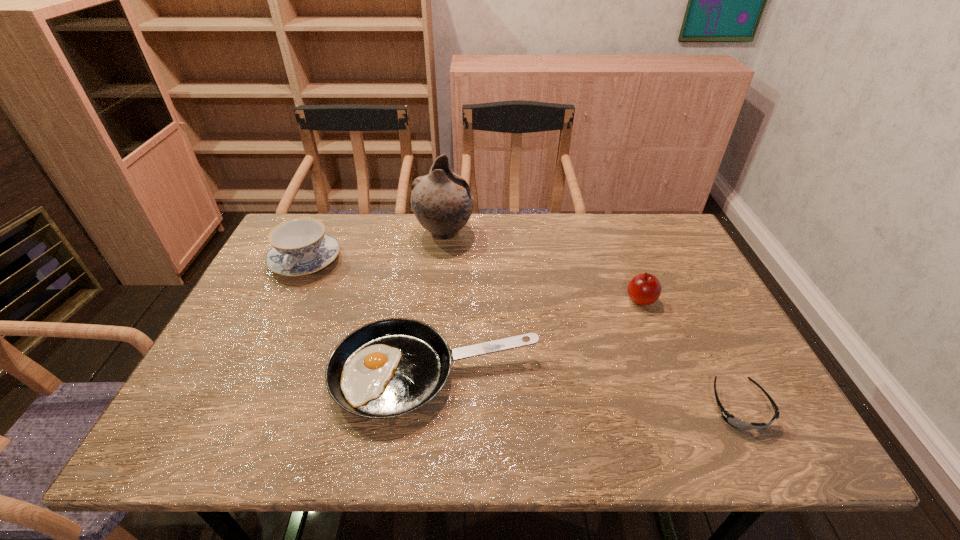
In order to click on vacant area situated on the left of the fourth tallest object in this screenshot , I will do `click(260, 374)`.

The height and width of the screenshot is (540, 960). In order to click on pottery that is at the far edge in this screenshot , I will do `click(442, 201)`.

Locate an element on the screen. The height and width of the screenshot is (540, 960). chinaware positioned at the far edge is located at coordinates (300, 246).

I want to click on frying pan that is at the near edge, so click(x=388, y=368).

The width and height of the screenshot is (960, 540). Identify the location of sunglasses present at the near edge. (730, 419).

At what (x,y) coordinates should I click in order to perform the action: click on object that is at the left edge. Please return your answer as a coordinate pair (x, y). The height and width of the screenshot is (540, 960). Looking at the image, I should click on (300, 246).

What are the coordinates of `apple located in the right edge section of the desktop` in the screenshot? It's located at (644, 289).

Where is `sunglasses that is at the right edge`? sunglasses that is at the right edge is located at coordinates (730, 419).

At what (x,y) coordinates should I click in order to perform the action: click on object that is at the far left corner. Please return your answer as a coordinate pair (x, y). Image resolution: width=960 pixels, height=540 pixels. Looking at the image, I should click on (300, 246).

This screenshot has height=540, width=960. I want to click on object at the near right corner, so click(730, 419).